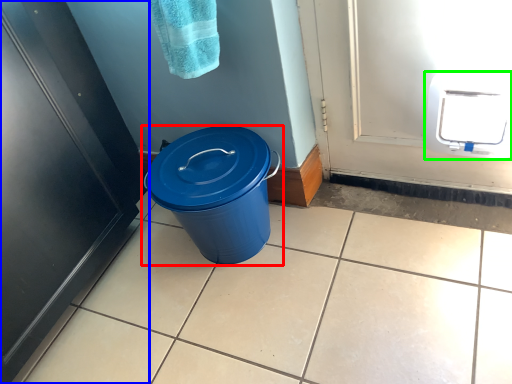
Question: Estimate the real-world distances between objects in this image. Which object is closer to waste container (highlighted by a red box), door (highlighted by a blue box) or appliance (highlighted by a green box)?

Choices:
 (A) door
 (B) appliance

Answer: (A)